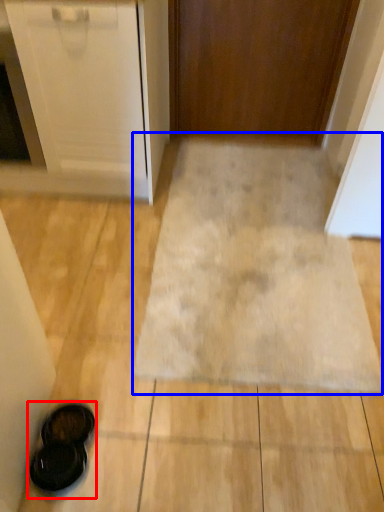
Question: Which object is closer to the camera taking this photo, footwear (highlighted by a red box) or bath mat (highlighted by a blue box)?

Choices:
 (A) footwear
 (B) bath mat

Answer: (A)